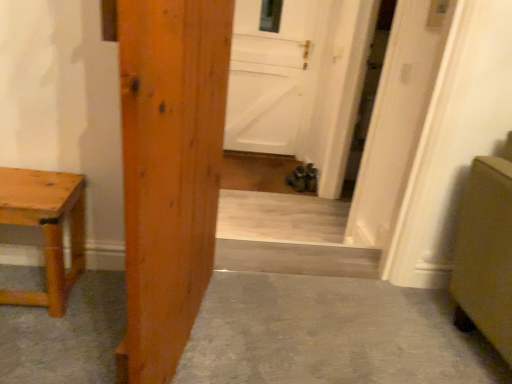
Question: From a real-world perspective, is wooden door at center, which appears as the 3th door when viewed from the back, physically located above or below white matte door at center, placed as the 1th door when sorted from right to left?

Choices:
 (A) above
 (B) below

Answer: (A)

Question: From the image's perspective, is wooden door at center, marked as the third door in a right-to-left arrangement, located above or below white matte door at center, placed as the 1th door when sorted from right to left?

Choices:
 (A) below
 (B) above

Answer: (A)

Question: Which is farther from the smooth concrete floor at center?

Choices:
 (A) white matte door at center, which is the 2th door in right-to-left order
 (B) natural wood table at left
 (C) wooden door at center, acting as the first door starting from the left
 (D) white matte door at center, the 3th door viewed from the left

Answer: (A)

Question: Estimate the real-world distances between objects in this image. Which object is farther from the white matte door at center, marked as the first door in a back-to-front arrangement?

Choices:
 (A) natural wood table at left
 (B) white matte door at center, the 2th door from the back
 (C) smooth concrete floor at center
 (D) wooden door at center, acting as the first door starting from the left

Answer: (D)